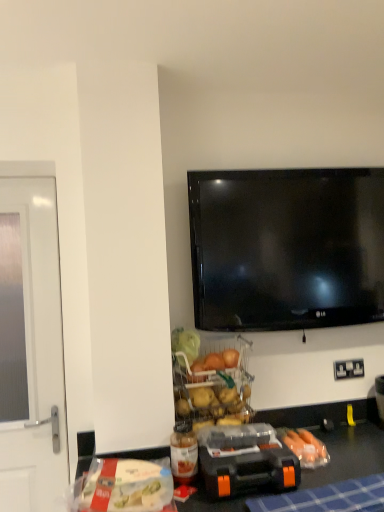
Question: Is blue checkered tablecloth at lower center facing towards clear glass screen door at left?

Choices:
 (A) no
 (B) yes

Answer: (A)

Question: Is blue checkered tablecloth at lower center next to clear glass screen door at left?

Choices:
 (A) no
 (B) yes

Answer: (A)

Question: Does blue checkered tablecloth at lower center have a larger size compared to clear glass screen door at left?

Choices:
 (A) no
 (B) yes

Answer: (B)

Question: Is blue checkered tablecloth at lower center facing away from clear glass screen door at left?

Choices:
 (A) no
 (B) yes

Answer: (A)

Question: Considering the relative sizes of blue checkered tablecloth at lower center and clear glass screen door at left in the image provided, is blue checkered tablecloth at lower center shorter than clear glass screen door at left?

Choices:
 (A) no
 (B) yes

Answer: (B)

Question: Is blue checkered tablecloth at lower center far away from clear glass screen door at left?

Choices:
 (A) no
 (B) yes

Answer: (B)

Question: Is black plastic toolbox at lower center looking in the opposite direction of white plastic bag at lower left?

Choices:
 (A) no
 (B) yes

Answer: (A)

Question: Can you confirm if black plastic toolbox at lower center is shorter than white plastic bag at lower left?

Choices:
 (A) no
 (B) yes

Answer: (A)

Question: Considering the relative sizes of black plastic toolbox at lower center and white plastic bag at lower left in the image provided, is black plastic toolbox at lower center smaller than white plastic bag at lower left?

Choices:
 (A) yes
 (B) no

Answer: (B)

Question: Does black plastic toolbox at lower center have a greater height compared to white plastic bag at lower left?

Choices:
 (A) no
 (B) yes

Answer: (B)

Question: Could white plastic bag at lower left be considered to be inside black plastic toolbox at lower center?

Choices:
 (A) yes
 (B) no

Answer: (B)

Question: From a real-world perspective, is black plastic toolbox at lower center physically above white plastic bag at lower left?

Choices:
 (A) yes
 (B) no

Answer: (A)

Question: Would you say white plastic bag at lower left is outside translucent plastic bottle at lower center?

Choices:
 (A) no
 (B) yes

Answer: (B)